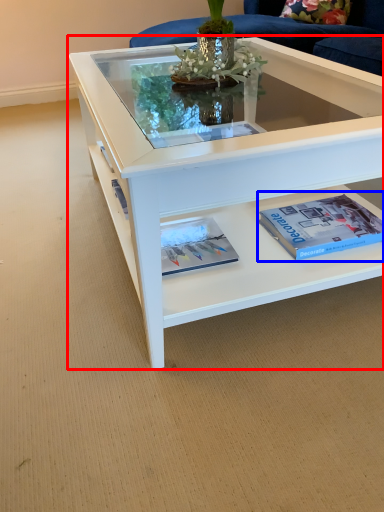
Question: Which point is closer to the camera, coffee table (highlighted by a red box) or paperback book (highlighted by a blue box)?

Choices:
 (A) coffee table
 (B) paperback book

Answer: (A)